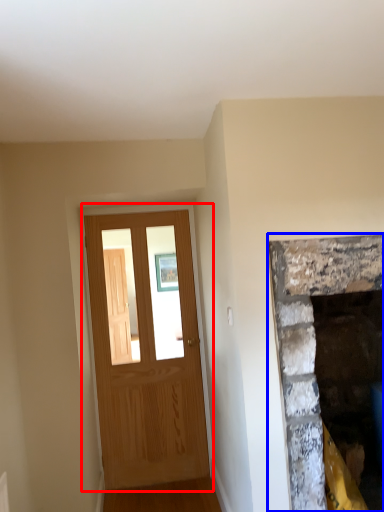
Question: Which object is further to the camera taking this photo, barn door (highlighted by a red box) or fireplace (highlighted by a blue box)?

Choices:
 (A) barn door
 (B) fireplace

Answer: (A)